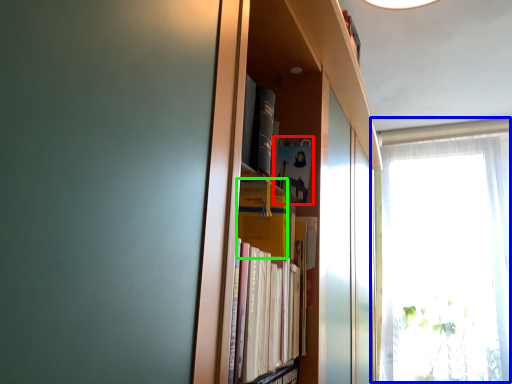
Question: Based on their relative distances, which object is nearer to paperback book (highlighted by a red box)? Choose from window (highlighted by a blue box) and paperback book (highlighted by a green box).

Choices:
 (A) window
 (B) paperback book

Answer: (B)